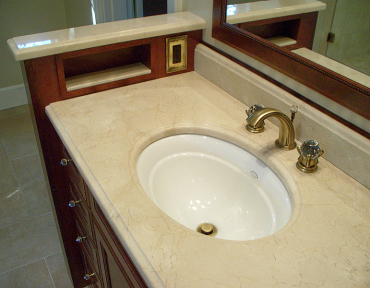
I want to click on backsplash, so click(x=226, y=74).